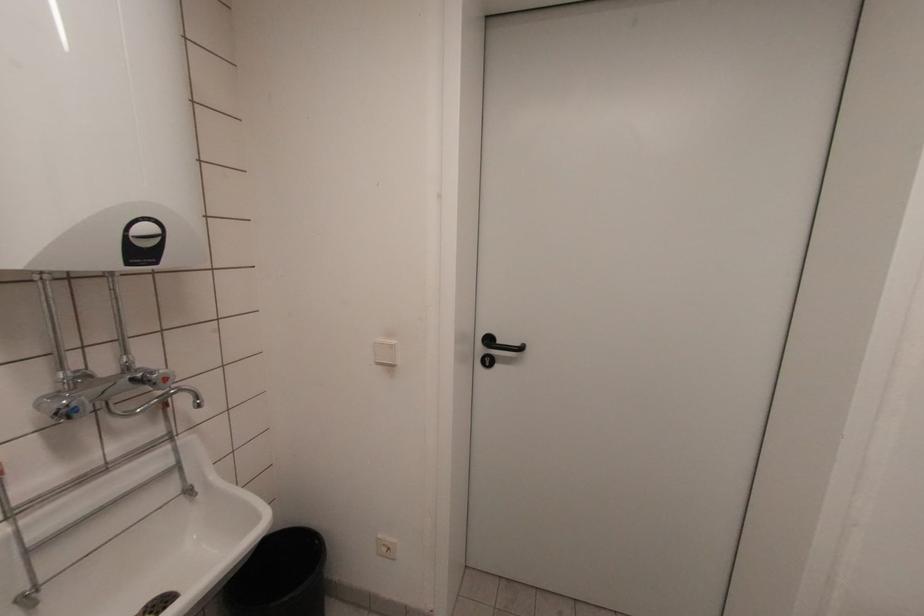
Locate an element on the screen. This screenshot has height=616, width=924. black door handle is located at coordinates (496, 350).